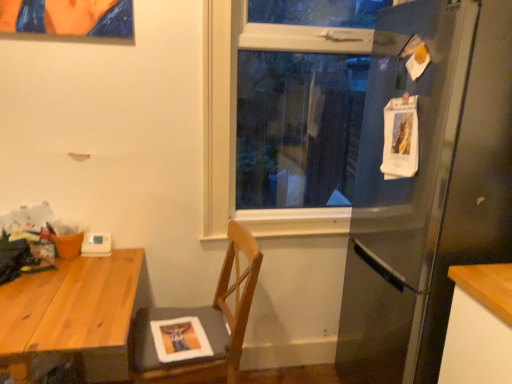
What do you see at coordinates (236, 115) in the screenshot? The width and height of the screenshot is (512, 384). I see `clear glass window at center` at bounding box center [236, 115].

Measure the distance between point (340, 34) and camera.

Point (340, 34) is 2.02 meters from camera.

Image resolution: width=512 pixels, height=384 pixels. What do you see at coordinates (71, 311) in the screenshot?
I see `wooden desk at left` at bounding box center [71, 311].

Image resolution: width=512 pixels, height=384 pixels. Find the location of `wooden desk at left`. wooden desk at left is located at coordinates (71, 311).

This screenshot has height=384, width=512. What do you see at coordinates (96, 245) in the screenshot? I see `white plastic thermostat at upper left` at bounding box center [96, 245].

What is the approximate height of wooden chair at center?

wooden chair at center is 35.08 inches in height.

Image resolution: width=512 pixels, height=384 pixels. What are the coordinates of `clear glass window at center` in the screenshot? It's located at (236, 115).

Who is bigger, wooden chair at center or clear glass window at center?

wooden chair at center.

From a real-world perspective, which object rests below the other?

In real-world perspective, wooden chair at center is lower.

Looking at this image, considering the sizes of objects wooden chair at center and clear glass window at center in the image provided, who is wider, wooden chair at center or clear glass window at center?

wooden chair at center.

Does point (145, 334) come in front of point (240, 39)?

Yes.

Is point (356, 281) more distant than point (102, 245)?

Yes, point (356, 281) is behind point (102, 245).

From a real-world perspective, does satin silver refrigerator at right sit lower than white plastic thermostat at upper left?

No, from a real-world perspective, satin silver refrigerator at right is not below white plastic thermostat at upper left.

Consider the image. In terms of height, does satin silver refrigerator at right look taller or shorter compared to white plastic thermostat at upper left?

Clearly, satin silver refrigerator at right is taller compared to white plastic thermostat at upper left.

In terms of size, does satin silver refrigerator at right appear bigger or smaller than white plastic thermostat at upper left?

Considering their sizes, satin silver refrigerator at right takes up more space than white plastic thermostat at upper left.

In the scene shown: Between clear glass window at center and wooden chair at center, which one has more height?

clear glass window at center.

Which object is closer to the camera, clear glass window at center or wooden chair at center?

Answer: wooden chair at center is closer to the camera.

How much distance is there between clear glass window at center and wooden chair at center?

The distance of clear glass window at center from wooden chair at center is 20.67 inches.

Locate an element on the screen. This screenshot has width=512, height=384. window on the right of wooden chair at center is located at coordinates (236, 115).

Is point (28, 345) positioned before point (98, 246)?

Yes.

The height and width of the screenshot is (384, 512). What are the coordinates of `desk below the white plastic thermostat at upper left (from the image's perspective)` in the screenshot? It's located at (71, 311).

Is point (72, 266) less distant than point (210, 237)?

That is True.

Can you confirm if wooden desk at left is positioned to the left of clear glass window at center?

Correct, you'll find wooden desk at left to the left of clear glass window at center.

Is wooden desk at left next to clear glass window at center and touching it?

There is a gap between wooden desk at left and clear glass window at center.

What's the angular difference between wooden desk at left and clear glass window at center's facing directions?

0.00362 degrees separate the facing orientations of wooden desk at left and clear glass window at center.

From a real-world perspective, is satin silver refrigerator at right physically below clear glass window at center?

Indeed, from a real-world perspective, satin silver refrigerator at right is positioned beneath clear glass window at center.

Choose the correct answer: Is satin silver refrigerator at right inside clear glass window at center or outside it?

satin silver refrigerator at right is located beyond the bounds of clear glass window at center.

Does satin silver refrigerator at right have a greater width compared to clear glass window at center?

Correct, the width of satin silver refrigerator at right exceeds that of clear glass window at center.

I want to click on window on the left of satin silver refrigerator at right, so click(x=236, y=115).

I want to click on appliance above the wooden chair at center (from the image's perspective), so click(96, 245).

From a real-world perspective, is wooden chair at center below white plastic thermostat at upper left?

Yes, from a real-world perspective, wooden chair at center is below white plastic thermostat at upper left.

Which object is wider, wooden chair at center or white plastic thermostat at upper left?

Wider between the two is wooden chair at center.

What's the angular difference between wooden chair at center and white plastic thermostat at upper left's facing directions?

79.1 degrees.

The width and height of the screenshot is (512, 384). What are the coordinates of `window on the right of wooden chair at center` in the screenshot? It's located at (236, 115).

Locate an element on the screen. This screenshot has height=384, width=512. refrigerator that is above the white plastic thermostat at upper left (from the image's perspective) is located at coordinates (428, 188).

Which object lies further to the anchor point wooden chair at center, satin silver refrigerator at right or wooden desk at left?

Among the two, satin silver refrigerator at right is located further to wooden chair at center.

Estimate the real-world distances between objects in this image. Which object is closer to wooden desk at left, white plastic thermostat at upper left or satin silver refrigerator at right?

Among the two, white plastic thermostat at upper left is located nearer to wooden desk at left.

Estimate the real-world distances between objects in this image. Which object is closer to wooden chair at center, clear glass window at center or satin silver refrigerator at right?

Based on the image, clear glass window at center appears to be nearer to wooden chair at center.

Based on their spatial positions, is white plastic thermostat at upper left or wooden desk at left further from satin silver refrigerator at right?

Based on the image, white plastic thermostat at upper left appears to be further to satin silver refrigerator at right.

Estimate the real-world distances between objects in this image. Which object is closer to wooden desk at left, white plastic thermostat at upper left or wooden chair at center?

white plastic thermostat at upper left is closer to wooden desk at left.

Based on their spatial positions, is wooden desk at left or wooden chair at center further from clear glass window at center?

Based on the image, wooden desk at left appears to be further to clear glass window at center.

Based on their spatial positions, is satin silver refrigerator at right or clear glass window at center closer to wooden chair at center?

clear glass window at center.

Estimate the real-world distances between objects in this image. Which object is further from wooden desk at left, clear glass window at center or white plastic thermostat at upper left?

The object further to wooden desk at left is clear glass window at center.

Identify the location of chair between white plastic thermostat at upper left and satin silver refrigerator at right. (202, 324).

You are a GUI agent. You are given a task and a screenshot of the screen. Output one action in this format:
    pyautogui.click(x=<x>, y=<y>)
    Task: Click on the chair located between wooden desk at left and satin silver refrigerator at right in the left-right direction
    The image size is (512, 384).
    Given the screenshot: What is the action you would take?
    pyautogui.click(x=202, y=324)

Where is `window between wooden desk at left and satin silver refrigerator at right`? The image size is (512, 384). window between wooden desk at left and satin silver refrigerator at right is located at coordinates (236, 115).

This screenshot has height=384, width=512. I want to click on chair between wooden desk at left and white plastic thermostat at upper left in the front-back direction, so click(x=202, y=324).